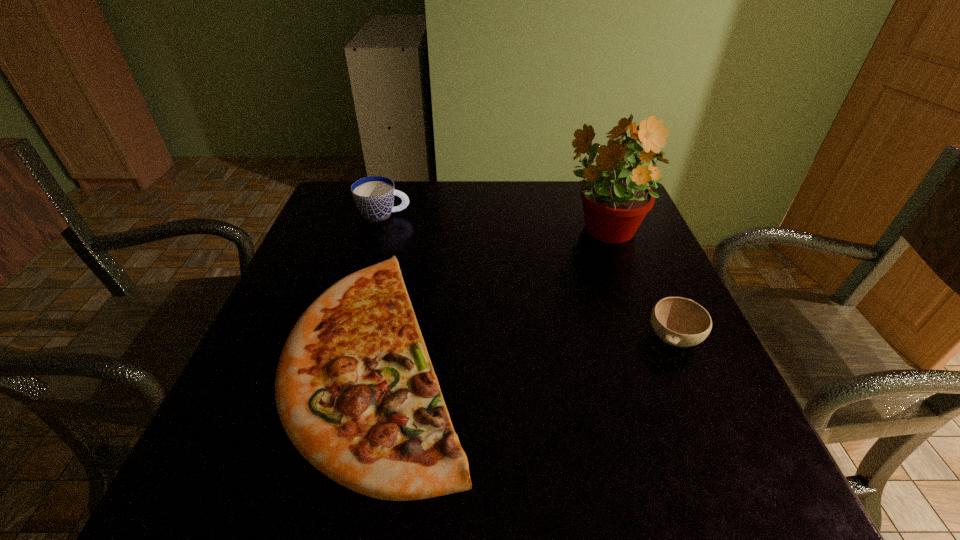
I want to click on flowerpot, so click(x=616, y=199).

Where is `cup`? cup is located at coordinates (374, 196).

Find the location of a particular element. This screenshot has height=540, width=960. bowl is located at coordinates (681, 322).

This screenshot has height=540, width=960. What are the coordinates of `pizza` in the screenshot? It's located at coord(355,389).

This screenshot has width=960, height=540. I want to click on vacant area situated on the front of the tallest object, so click(x=659, y=389).

Where is `free space located on the side of the third shortest object with the handle`? This screenshot has width=960, height=540. free space located on the side of the third shortest object with the handle is located at coordinates (473, 215).

The height and width of the screenshot is (540, 960). I want to click on vacant position located 0.230m on the back of the bowl, so click(x=634, y=246).

Find the location of `flowerpot located at the far edge`. flowerpot located at the far edge is located at coordinates (616, 199).

Image resolution: width=960 pixels, height=540 pixels. Identify the location of cup that is at the far edge. (374, 196).

Locate an element on the screen. The height and width of the screenshot is (540, 960). object that is at the near edge is located at coordinates (355, 389).